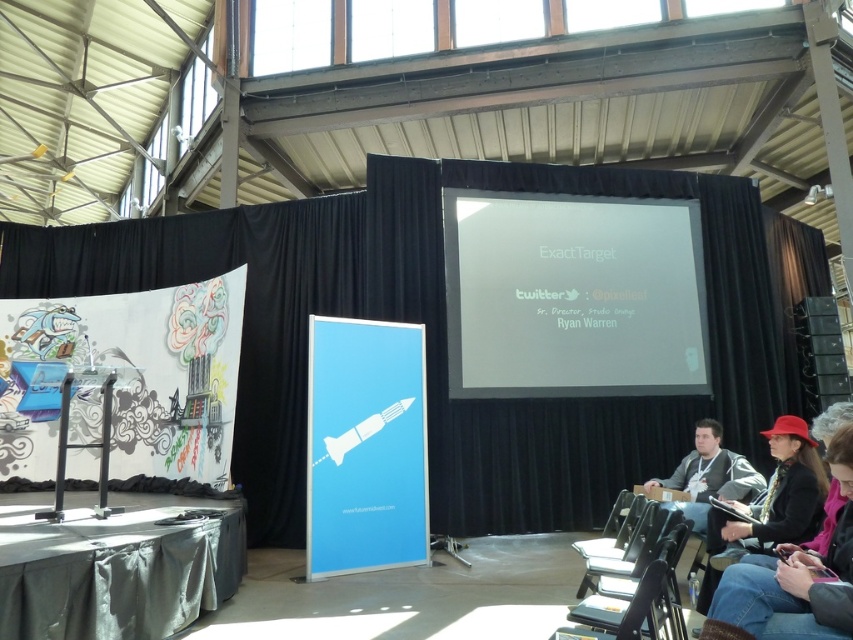
Is black leather jacket at lower right thinner than metallic silver chair at lower right?

Incorrect, black leather jacket at lower right's width is not less than metallic silver chair at lower right's.

Describe the element at coordinates (708, 474) in the screenshot. I see `black leather jacket at lower right` at that location.

Which is behind, point (740, 486) or point (660, 596)?

Point (740, 486)

Where is `black leather jacket at lower right`? black leather jacket at lower right is located at coordinates (708, 474).

Between black matte curtain at center and matte black jacket at lower right, which one appears on the right side from the viewer's perspective?

Positioned to the right is matte black jacket at lower right.

You are a GUI agent. You are given a task and a screenshot of the screen. Output one action in this format:
    pyautogui.click(x=<x>, y=<y>)
    Task: Click on the black matte curtain at center
    Image resolution: width=853 pixels, height=640 pixels.
    Given the screenshot: What is the action you would take?
    pyautogui.click(x=436, y=337)

Who is more distant from viewer, (735, 403) or (746, 588)?

Point (735, 403)

Where is `black matte curtain at center`? The height and width of the screenshot is (640, 853). black matte curtain at center is located at coordinates (436, 337).

Between white matte projector screen at center and matte black jacket at lower right, which one appears on the left side from the viewer's perspective?

matte black jacket at lower right

Consider the image. Measure the distance between white matte projector screen at center and camera.

white matte projector screen at center is 5.79 meters from camera.

Which is in front, point (482, 264) or point (750, 593)?

Point (750, 593)

The height and width of the screenshot is (640, 853). Find the location of `white matte projector screen at center`. white matte projector screen at center is located at coordinates (572, 296).